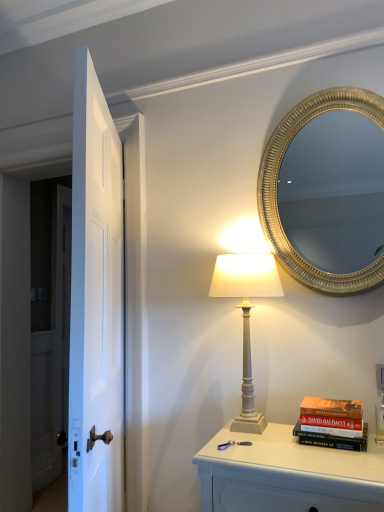
I want to click on free location in front of hardcover book at right, so click(344, 461).